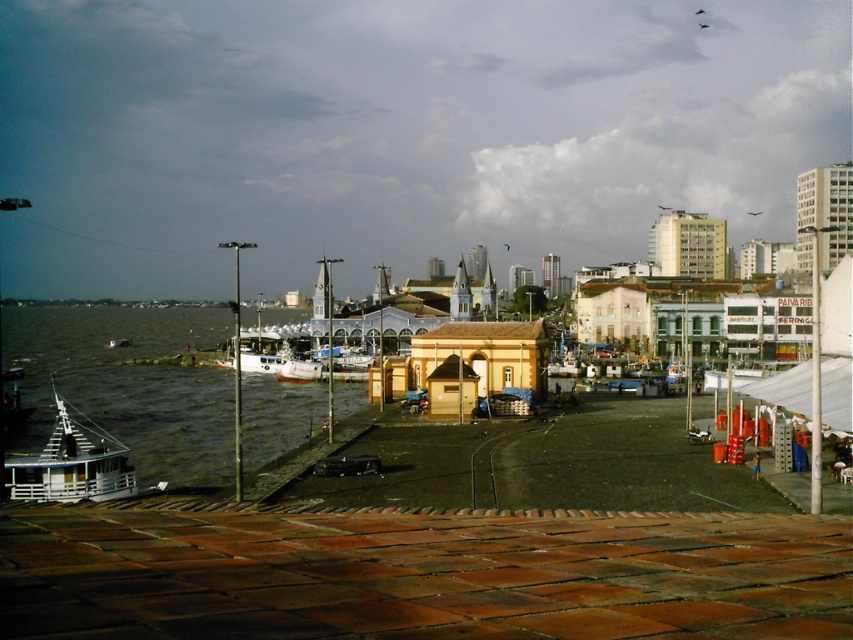
Question: Is brown wooden dock at lower center wider than greenish water at lower left?

Choices:
 (A) no
 (B) yes

Answer: (A)

Question: Can you confirm if brown wooden dock at lower center is positioned to the right of greenish water at lower left?

Choices:
 (A) no
 (B) yes

Answer: (B)

Question: Among these points, which one is nearest to the camera?

Choices:
 (A) pos(213,417)
 (B) pos(90,620)
 (C) pos(96,499)

Answer: (B)

Question: Which of the following is the closest to the observer?

Choices:
 (A) brown wooden dock at lower center
 (B) white wooden boat at lower left
 (C) greenish water at lower left

Answer: (A)

Question: Which of the following is the farthest from the observer?

Choices:
 (A) (189, 604)
 (B) (297, 387)
 (C) (57, 460)

Answer: (B)

Question: Can you confirm if brown wooden dock at lower center is wider than white wooden boat at lower left?

Choices:
 (A) yes
 (B) no

Answer: (B)